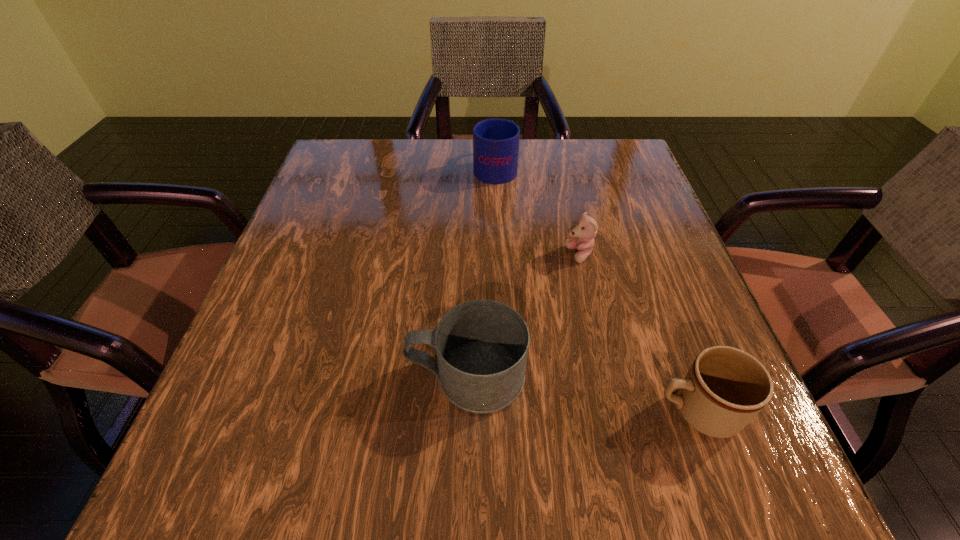
Identify the location of the farthest object. (495, 141).

Where is `the rightmost object`? the rightmost object is located at coordinates (725, 388).

This screenshot has height=540, width=960. Identify the location of teddy bear. (586, 228).

Find the location of a particular element. This screenshot has width=960, height=540. the third nearest object is located at coordinates (586, 228).

This screenshot has width=960, height=540. I want to click on free location located on the side of the rightmost object with the handle, so click(507, 410).

The height and width of the screenshot is (540, 960). I want to click on vacant area situated on the side of the rightmost object with the handle, so click(507, 410).

Identify the location of vacant region located 0.320m on the side of the rightmost object with the handle. (430, 410).

Where is `free space located at the face of the second farthest object`? The height and width of the screenshot is (540, 960). free space located at the face of the second farthest object is located at coordinates 447,255.

Identify the location of vacant area situated 0.240m at the face of the second farthest object. This screenshot has height=540, width=960. (443, 255).

This screenshot has height=540, width=960. I want to click on vacant space situated at the face of the second farthest object, so click(x=391, y=255).